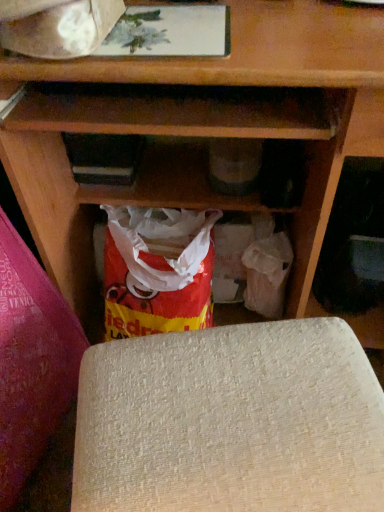
What are the coordinates of `matte plastic grocery bag at lower right` in the screenshot? It's located at (267, 274).

Find the location of `white paper at upper left`. white paper at upper left is located at coordinates (62, 29).

You are a GUI agent. You are given a task and a screenshot of the screen. Output one action in this format:
    pyautogui.click(x=<x>, y=<y>)
    Task: Click on the matte plastic grocery bag at lower right
    
    Given the screenshot: What is the action you would take?
    pyautogui.click(x=267, y=274)

Is the depth of matte plastic grocery bag at lower right less than that of beige textured yoga mat at lower left, the 2th yoga mat from the right?

No, matte plastic grocery bag at lower right is further to the viewer.

Is beige textured yoga mat at lower left, placed as the first yoga mat when sorted from left to right, completely or partially inside matte plastic grocery bag at lower right?

No, beige textured yoga mat at lower left, placed as the first yoga mat when sorted from left to right, is not surrounded by matte plastic grocery bag at lower right.

Find the location of a particular element. The image size is (384, 512). the 2nd yoga mat in front of the matte plastic grocery bag at lower right, starting your count from the anchor is located at coordinates (31, 361).

Is beige textured yoga mat at lower left, the 2th yoga mat from the right, not inside beige textured yoga mat at lower center, acting as the 2th yoga mat starting from the left?

Yes.

Which is less distant, (x=55, y=369) or (x=268, y=473)?

Point (x=55, y=369).

Is beige textured yoga mat at lower left, the 2th yoga mat from the right, positioned with its back to beige textured yoga mat at lower center, the first yoga mat positioned from the right?

beige textured yoga mat at lower left, the 2th yoga mat from the right, does not have its back to beige textured yoga mat at lower center, the first yoga mat positioned from the right.

Is beige textured yoga mat at lower center, acting as the 2th yoga mat starting from the left, placed right next to matte plastic grocery bag at lower right?

There is a gap between beige textured yoga mat at lower center, acting as the 2th yoga mat starting from the left, and matte plastic grocery bag at lower right.

At what (x,y) coordinates should I click in order to perform the action: click on the 1st yoga mat in front of the matte plastic grocery bag at lower right, starting your count from the anchor. Please return your answer as a coordinate pair (x, y). The width and height of the screenshot is (384, 512). Looking at the image, I should click on (230, 421).

Looking at their sizes, would you say beige textured yoga mat at lower center, acting as the 2th yoga mat starting from the left, is wider or thinner than matte plastic grocery bag at lower right?

Considering their sizes, beige textured yoga mat at lower center, acting as the 2th yoga mat starting from the left, looks broader than matte plastic grocery bag at lower right.

How different are the orientations of beige textured yoga mat at lower center, the first yoga mat positioned from the right, and matte plastic grocery bag at lower right in degrees?

The angular difference between beige textured yoga mat at lower center, the first yoga mat positioned from the right, and matte plastic grocery bag at lower right is 8.73 degrees.

Considering the sizes of white paper at upper left and beige textured yoga mat at lower center, the first yoga mat positioned from the right, in the image, is white paper at upper left bigger or smaller than beige textured yoga mat at lower center, the first yoga mat positioned from the right,?

Clearly, white paper at upper left is smaller in size than beige textured yoga mat at lower center, the first yoga mat positioned from the right.

Is white paper at upper left turned away from beige textured yoga mat at lower center, acting as the 2th yoga mat starting from the left?

No, beige textured yoga mat at lower center, acting as the 2th yoga mat starting from the left, is not at the back of white paper at upper left.

From the picture: Is white paper at upper left at the right side of beige textured yoga mat at lower center, the first yoga mat positioned from the right?

Incorrect, white paper at upper left is not on the right side of beige textured yoga mat at lower center, the first yoga mat positioned from the right.

What's the angular difference between white paper at upper left and beige textured yoga mat at lower center, acting as the 2th yoga mat starting from the left,'s facing directions?

10.7 degrees separate the facing orientations of white paper at upper left and beige textured yoga mat at lower center, acting as the 2th yoga mat starting from the left.

Does beige textured yoga mat at lower center, the first yoga mat positioned from the right, have a lesser height compared to white paper at upper left?

Incorrect, the height of beige textured yoga mat at lower center, the first yoga mat positioned from the right, does not fall short of that of white paper at upper left.

Is beige textured yoga mat at lower center, acting as the 2th yoga mat starting from the left, next to white paper at upper left?

beige textured yoga mat at lower center, acting as the 2th yoga mat starting from the left, is not next to white paper at upper left, and they're not touching.

Considering the points (165, 498) and (73, 34), which point is in front, point (165, 498) or point (73, 34)?

Positioned in front is point (165, 498).

Which object is closer to the camera taking this photo, beige textured yoga mat at lower center, the first yoga mat positioned from the right, or white paper at upper left?

beige textured yoga mat at lower center, the first yoga mat positioned from the right.

Between beige textured yoga mat at lower left, placed as the first yoga mat when sorted from left to right, and matte plastic grocery bag at lower right, which one has more height?

Standing taller between the two is beige textured yoga mat at lower left, placed as the first yoga mat when sorted from left to right.

Considering the positions of point (23, 283) and point (260, 286), is point (23, 283) closer or farther from the camera than point (260, 286)?

Point (23, 283) is closer to the camera than point (260, 286).

Is beige textured yoga mat at lower left, placed as the first yoga mat when sorted from left to right, inside the boundaries of matte plastic grocery bag at lower right, or outside?

beige textured yoga mat at lower left, placed as the first yoga mat when sorted from left to right, lies outside matte plastic grocery bag at lower right.

Considering the relative sizes of beige textured yoga mat at lower left, placed as the first yoga mat when sorted from left to right, and matte plastic grocery bag at lower right in the image provided, is beige textured yoga mat at lower left, placed as the first yoga mat when sorted from left to right, wider than matte plastic grocery bag at lower right?

Indeed, beige textured yoga mat at lower left, placed as the first yoga mat when sorted from left to right, has a greater width compared to matte plastic grocery bag at lower right.

Are white paper at upper left and matte plastic grocery bag at lower right located far from each other?

white paper at upper left is actually quite close to matte plastic grocery bag at lower right.

Considering the sizes of objects white paper at upper left and matte plastic grocery bag at lower right in the image provided, who is wider, white paper at upper left or matte plastic grocery bag at lower right?

white paper at upper left.

From the picture: From the image's perspective, does white paper at upper left appear higher than matte plastic grocery bag at lower right?

Correct, white paper at upper left appears higher than matte plastic grocery bag at lower right in the image.

Is white paper at upper left closer to the viewer compared to matte plastic grocery bag at lower right?

Yes, white paper at upper left is closer to the viewer.

You are a GUI agent. You are given a task and a screenshot of the screen. Output one action in this format:
    pyautogui.click(x=<x>, y=<y>)
    Task: Click on the yoga mat that is the 2nd one above the matte plastic grocery bag at lower right (from a real-world perspective)
    This screenshot has height=512, width=384.
    Given the screenshot: What is the action you would take?
    pyautogui.click(x=31, y=361)

Identify the location of yoga mat in front of the beige textured yoga mat at lower center, the first yoga mat positioned from the right. The width and height of the screenshot is (384, 512). (31, 361).

From the image, which object appears to be farther from beige textured yoga mat at lower center, acting as the 2th yoga mat starting from the left, white paper at upper left or beige textured yoga mat at lower left, placed as the first yoga mat when sorted from left to right?

Based on the image, white paper at upper left appears to be further to beige textured yoga mat at lower center, acting as the 2th yoga mat starting from the left.

Which object lies nearer to the anchor point beige textured yoga mat at lower left, the 2th yoga mat from the right, white paper at upper left or beige textured yoga mat at lower center, acting as the 2th yoga mat starting from the left?

beige textured yoga mat at lower center, acting as the 2th yoga mat starting from the left.

Considering their positions, is white paper at upper left positioned further to beige textured yoga mat at lower center, the first yoga mat positioned from the right, than matte plastic grocery bag at lower right?

white paper at upper left lies further to beige textured yoga mat at lower center, the first yoga mat positioned from the right, than the other object.

Looking at the image, which one is located closer to white paper at upper left, beige textured yoga mat at lower center, the first yoga mat positioned from the right, or beige textured yoga mat at lower left, the 2th yoga mat from the right?

beige textured yoga mat at lower center, the first yoga mat positioned from the right, lies closer to white paper at upper left than the other object.

When comparing their distances from matte plastic grocery bag at lower right, does white paper at upper left or beige textured yoga mat at lower left, the 2th yoga mat from the right, seem closer?

beige textured yoga mat at lower left, the 2th yoga mat from the right, is closer to matte plastic grocery bag at lower right.

From the image, which object appears to be farther from beige textured yoga mat at lower center, acting as the 2th yoga mat starting from the left, beige textured yoga mat at lower left, placed as the first yoga mat when sorted from left to right, or matte plastic grocery bag at lower right?

matte plastic grocery bag at lower right is positioned further to the anchor beige textured yoga mat at lower center, acting as the 2th yoga mat starting from the left.

When comparing their distances from matte plastic grocery bag at lower right, does beige textured yoga mat at lower center, the first yoga mat positioned from the right, or white paper at upper left seem closer?

beige textured yoga mat at lower center, the first yoga mat positioned from the right, is positioned closer to the anchor matte plastic grocery bag at lower right.

Which object lies further to the anchor point matte plastic grocery bag at lower right, white paper at upper left or beige textured yoga mat at lower center, the first yoga mat positioned from the right?

white paper at upper left.

At what (x,y) coordinates should I click in order to perform the action: click on yoga mat between white paper at upper left and beige textured yoga mat at lower center, acting as the 2th yoga mat starting from the left, in the vertical direction. Please return your answer as a coordinate pair (x, y). This screenshot has height=512, width=384. Looking at the image, I should click on (31, 361).

In order to click on grocery bag between white paper at upper left and beige textured yoga mat at lower center, acting as the 2th yoga mat starting from the left, in the vertical direction in this screenshot , I will do `click(267, 274)`.

Image resolution: width=384 pixels, height=512 pixels. In order to click on wrapping paper between beige textured yoga mat at lower left, the 2th yoga mat from the right, and matte plastic grocery bag at lower right in the front-back direction in this screenshot , I will do `click(62, 29)`.

Locate an element on the screen. The width and height of the screenshot is (384, 512). yoga mat located between beige textured yoga mat at lower left, the 2th yoga mat from the right, and matte plastic grocery bag at lower right in the depth direction is located at coordinates (230, 421).